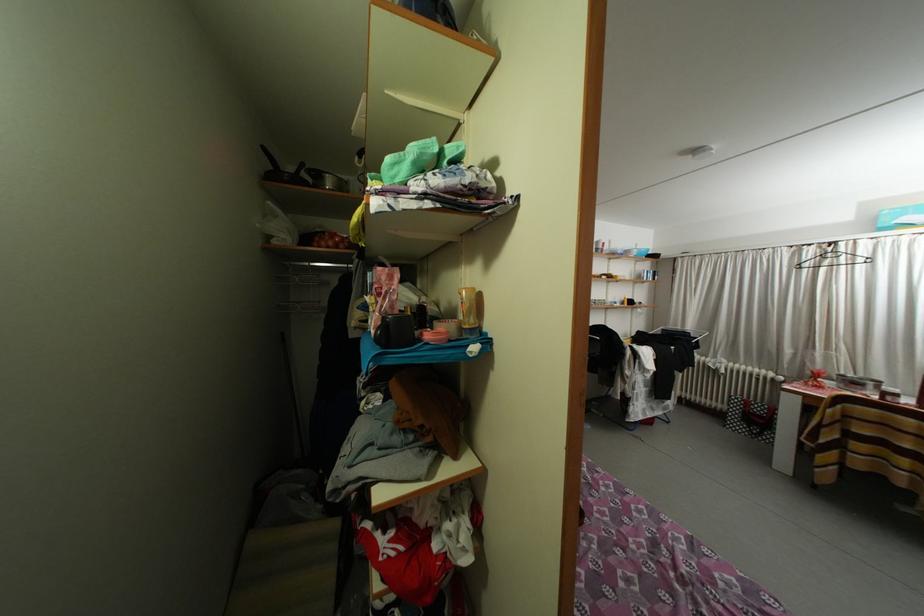
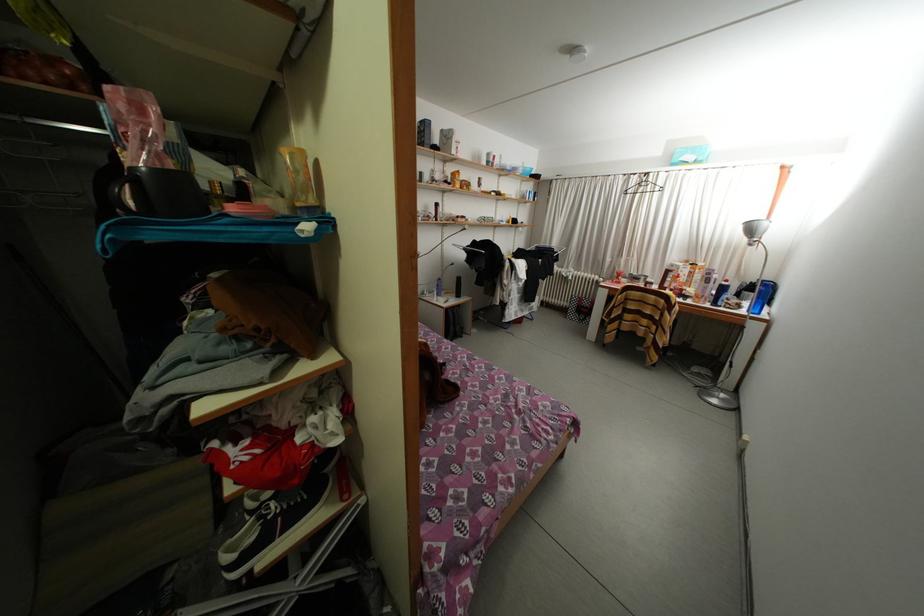
Locate, in the second image, the point that corresponds to pixel 472 331 in the first image.

(306, 209)